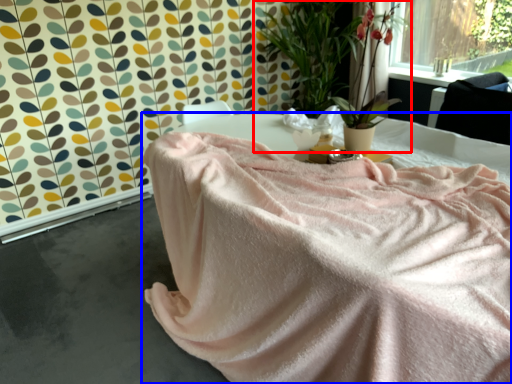
Question: Among these objects, which one is nearest to the camera, houseplant (highlighted by a red box) or furniture (highlighted by a blue box)?

Choices:
 (A) houseplant
 (B) furniture

Answer: (B)